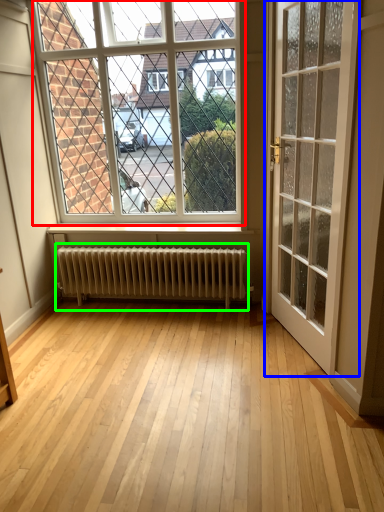
Question: Considering the real-world distances, which object is closest to window (highlighted by a red box)? door (highlighted by a blue box) or radiator (highlighted by a green box).

Choices:
 (A) door
 (B) radiator

Answer: (B)